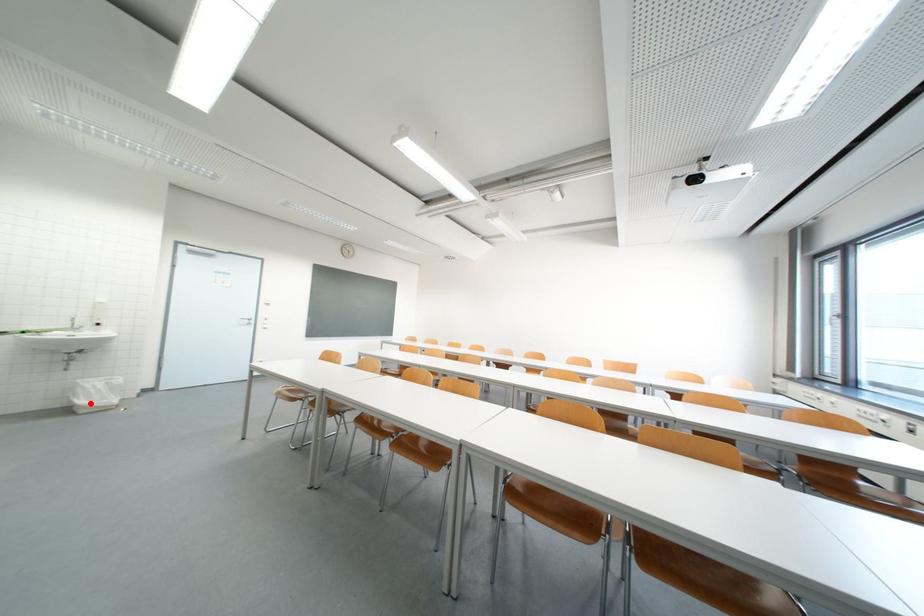
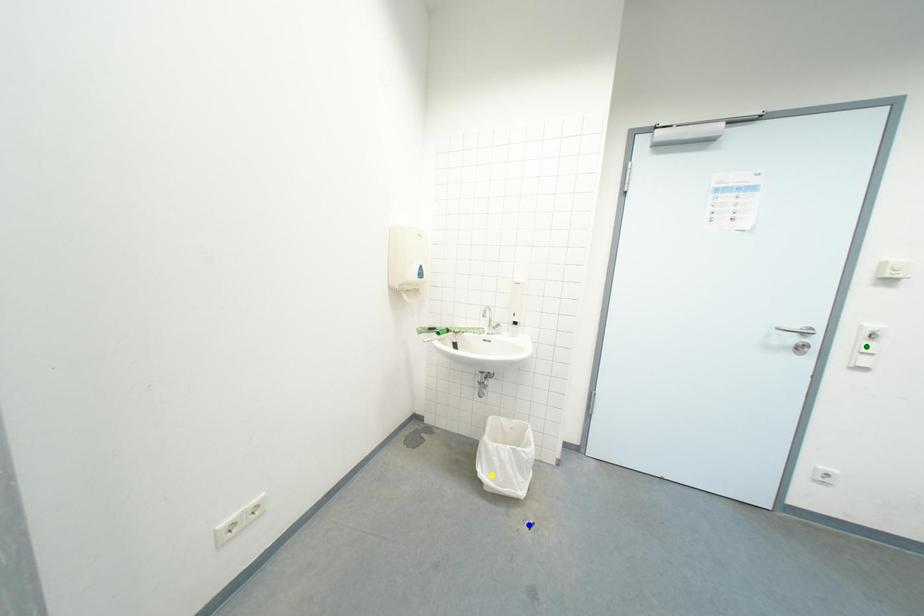
Question: I am providing you with two images of the same scene from different viewpoints. A red point is marked on the first image. You are given multiple points on the second image. Which spot in image 2 lines up with the point in image 1?

Choices:
 (A) green point
 (B) blue point
 (C) yellow point

Answer: (C)